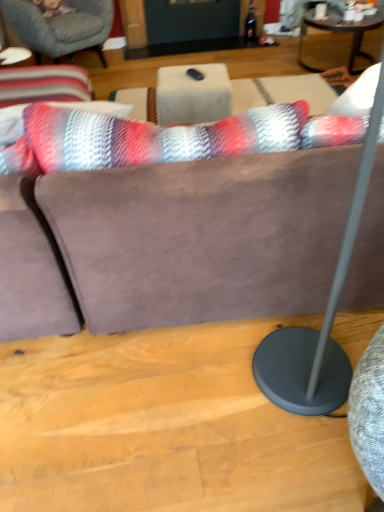
Question: From their relative heights in the image, would you say matte gray floor lamp at right is taller or shorter than white marble table at center?

Choices:
 (A) short
 (B) tall

Answer: (B)

Question: Is matte gray floor lamp at right to the left or to the right of white marble table at center in the image?

Choices:
 (A) right
 (B) left

Answer: (A)

Question: Considering the real-world distances, which object is closest to the dark brown wooden coffee table at upper right?

Choices:
 (A) matte gray floor lamp at right
 (B) striped fabric cushion at upper left
 (C) white marble table at center

Answer: (C)

Question: Which object is the farthest from the matte gray floor lamp at right?

Choices:
 (A) striped fabric cushion at upper left
 (B) dark brown wooden coffee table at upper right
 (C) white marble table at center

Answer: (A)